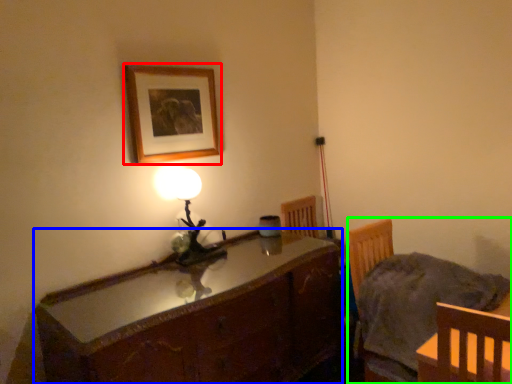
Question: Based on their relative distances, which object is farther from picture frame (highlighted by a red box)? Choose from cabinetry (highlighted by a blue box) and chair (highlighted by a green box).

Choices:
 (A) cabinetry
 (B) chair

Answer: (B)